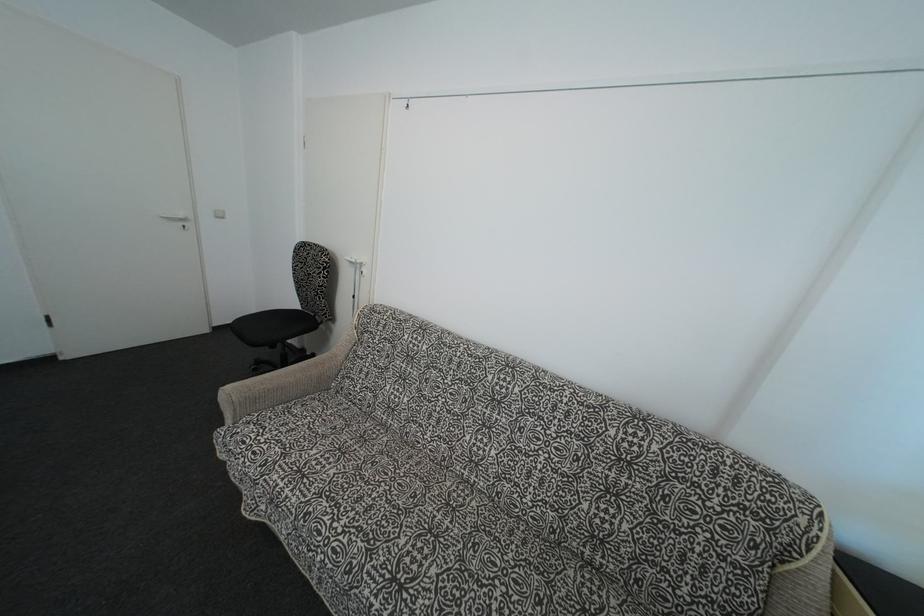
Where would you pull the white door handle? Please return your answer as a coordinate pair (x, y).

(176, 216)